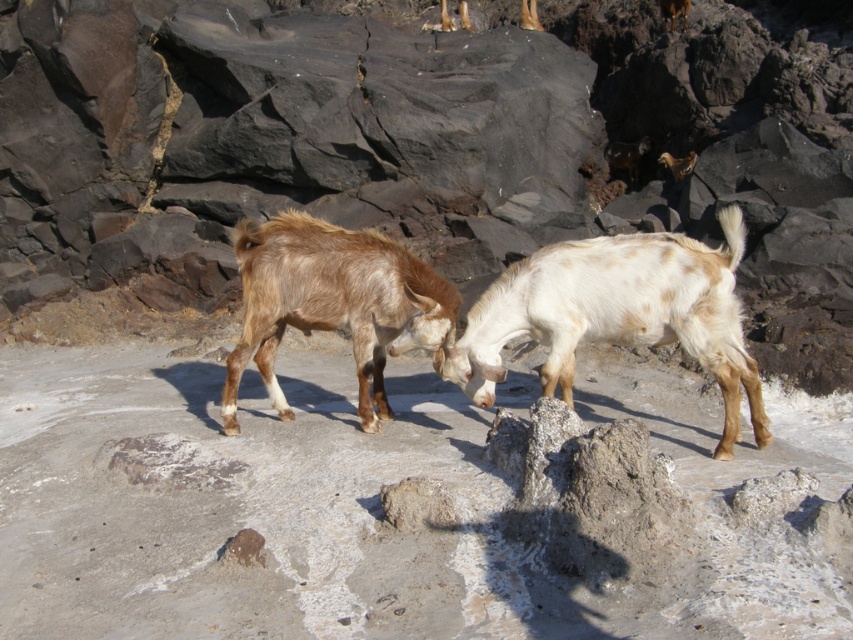
Is white speckled fur at center smaller than brown fuzzy goat at center?

Incorrect, white speckled fur at center is not smaller in size than brown fuzzy goat at center.

Which of these two, white speckled fur at center or brown fuzzy goat at center, stands shorter?

white speckled fur at center is shorter.

This screenshot has width=853, height=640. Identify the location of white speckled fur at center. pyautogui.click(x=619, y=314).

Identify the location of white speckled fur at center. The image size is (853, 640). (619, 314).